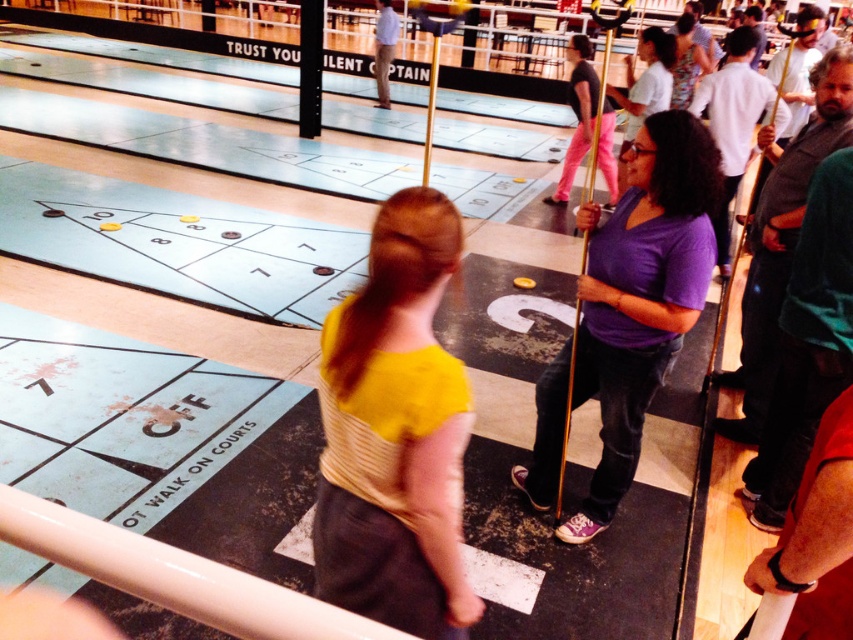
Who is lower down, yellow fabric shirt at center or matte purple shirt at center?

yellow fabric shirt at center is below.

Which is in front, point (367, 531) or point (604, 109)?

Point (367, 531)

Find the location of `yellow fabric shirt at center`. yellow fabric shirt at center is located at coordinates (395, 433).

Does yellow fabric shirt at center appear on the left side of purple matte shirt at center?

Yes, yellow fabric shirt at center is to the left of purple matte shirt at center.

Is yellow fabric shirt at center positioned at the back of purple matte shirt at center?

No, it is in front of purple matte shirt at center.

Measure the distance between yellow fabric shirt at center and camera.

1.37 meters

Locate an element on the screen. The width and height of the screenshot is (853, 640). yellow fabric shirt at center is located at coordinates (395, 433).

Between purple matte shirt at center and matte purple shirt at center, which one has more height?

purple matte shirt at center

Identify the location of purple matte shirt at center. (641, 296).

At what (x,y) coordinates should I click in order to perform the action: click on purple matte shirt at center. Please return your answer as a coordinate pair (x, y). This screenshot has width=853, height=640. Looking at the image, I should click on (641, 296).